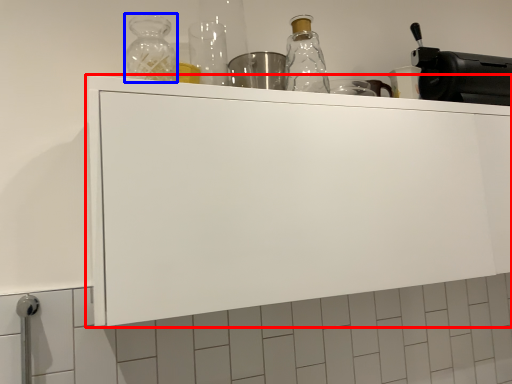
Question: Among these objects, which one is farthest to the camera, cabinetry (highlighted by a red box) or bottle (highlighted by a blue box)?

Choices:
 (A) cabinetry
 (B) bottle

Answer: (B)